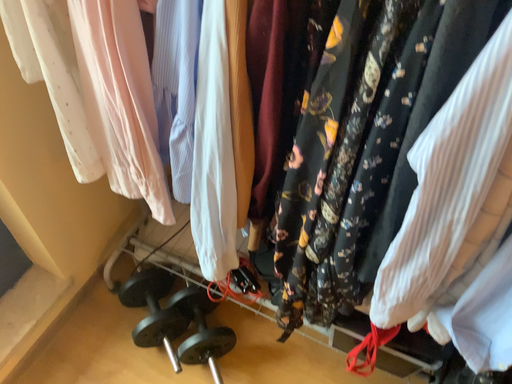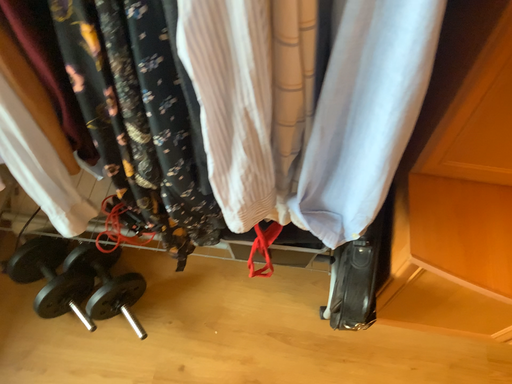
Question: How did the camera likely rotate when shooting the video?

Choices:
 (A) rotated upward
 (B) rotated downward

Answer: (B)